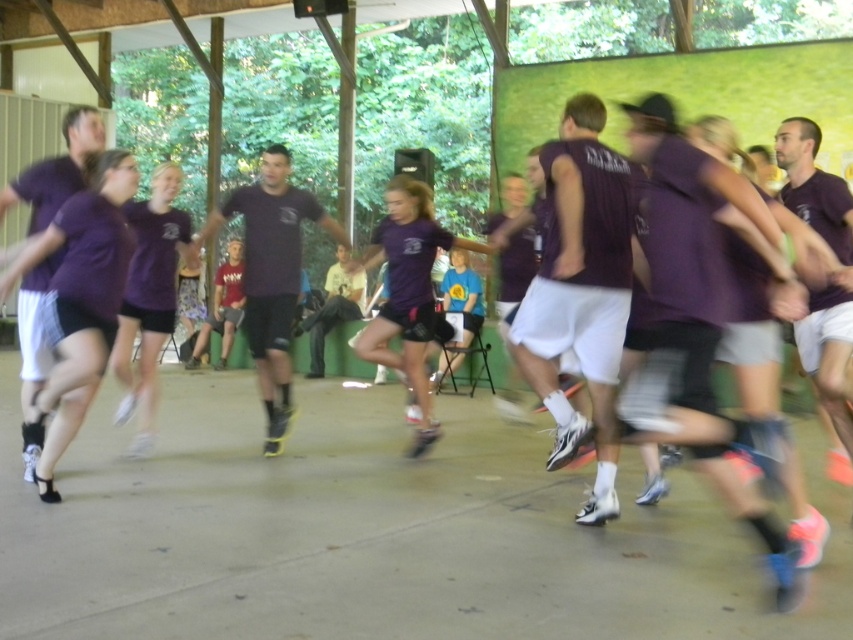
Is point (62, 376) closer to camera compared to point (157, 172)?

Yes, it is in front of point (157, 172).

Who is more distant from viewer, (85, 275) or (155, 173)?

Positioned behind is point (155, 173).

Which is in front, point (114, 168) or point (143, 284)?

Point (114, 168) is more forward.

Find the location of a particular element. The height and width of the screenshot is (640, 853). purple matte shorts at left is located at coordinates (79, 301).